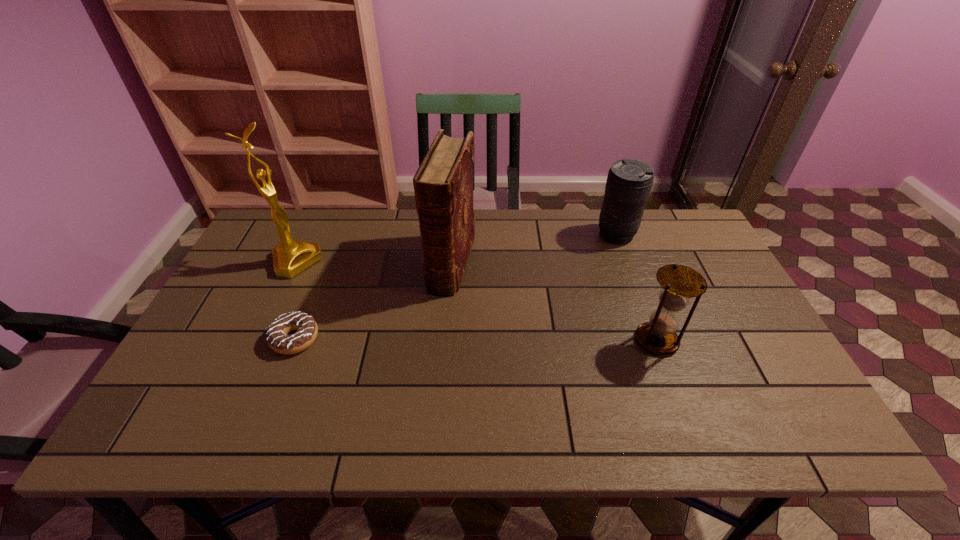
The height and width of the screenshot is (540, 960). I want to click on free space located 0.070m on the spine side of the third object from right to left, so click(x=439, y=315).

Identify the location of free space located on the side of the telephoto lens where the control switches are located. This screenshot has height=540, width=960. (548, 302).

You are a GUI agent. You are given a task and a screenshot of the screen. Output one action in this format:
    pyautogui.click(x=<x>, y=<y>)
    Task: Click on the vacant area located on the side of the telephoto lens where the control switches are located
    This screenshot has width=960, height=540.
    Given the screenshot: What is the action you would take?
    pyautogui.click(x=538, y=313)

What are the coordinates of `vacant space located on the side of the telephoto lens where the control switches are located` in the screenshot? It's located at (575, 276).

Identify the location of free space located on the front-facing side of the award. The height and width of the screenshot is (540, 960). (379, 307).

Find the location of a particular element. The height and width of the screenshot is (540, 960). vacant region located 0.170m on the front-facing side of the award is located at coordinates (355, 294).

You are a GUI agent. You are given a task and a screenshot of the screen. Output one action in this format:
    pyautogui.click(x=<x>, y=<y>)
    Task: Click on the vacant space located on the front-facing side of the award
    
    Given the screenshot: What is the action you would take?
    pyautogui.click(x=391, y=313)

Find the location of a particular element. The height and width of the screenshot is (540, 960). hardback book present at the far edge is located at coordinates (443, 185).

Identify the location of telephoto lens that is at the far edge. (629, 181).

Find the location of a particular element. This screenshot has height=540, width=960. award present at the far edge is located at coordinates (290, 257).